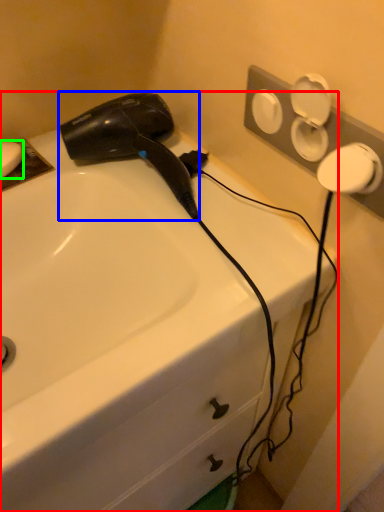
Question: Which object is positioned farthest from sink (highlighted by a red box)? Select from hair drier (highlighted by a blue box) and soap (highlighted by a green box).

Choices:
 (A) hair drier
 (B) soap

Answer: (B)